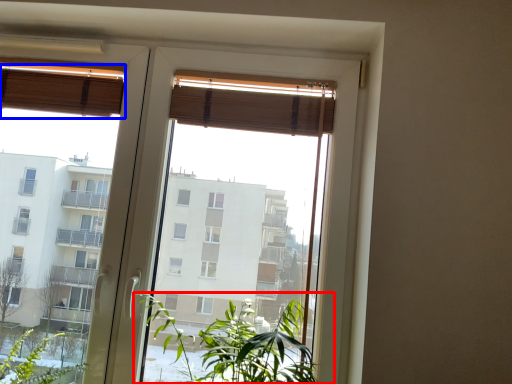
Question: Among these objects, which one is farthest to the camera, houseplant (highlighted by a red box) or curtain (highlighted by a blue box)?

Choices:
 (A) houseplant
 (B) curtain

Answer: (B)